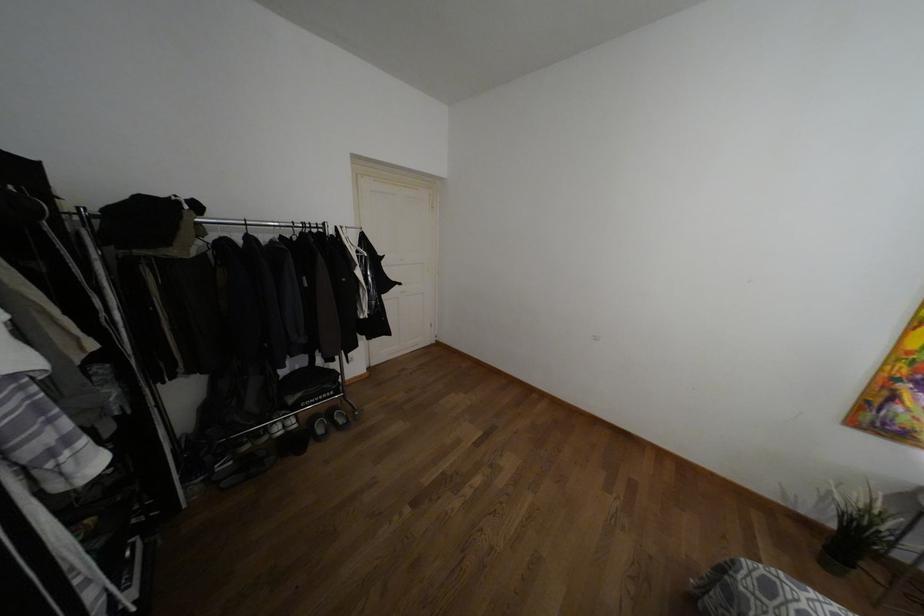
The height and width of the screenshot is (616, 924). I want to click on sofa sitting surface, so click(757, 592).